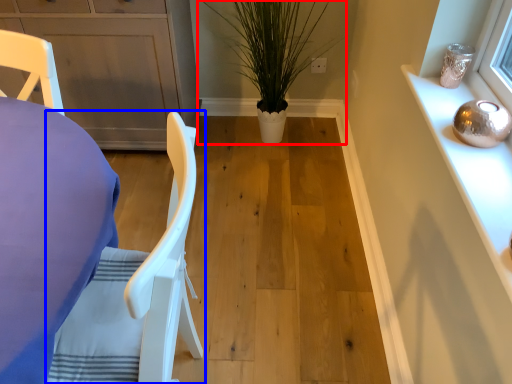
Question: Which of the following is the closest to the observer, houseplant (highlighted by a red box) or chair (highlighted by a blue box)?

Choices:
 (A) houseplant
 (B) chair

Answer: (B)